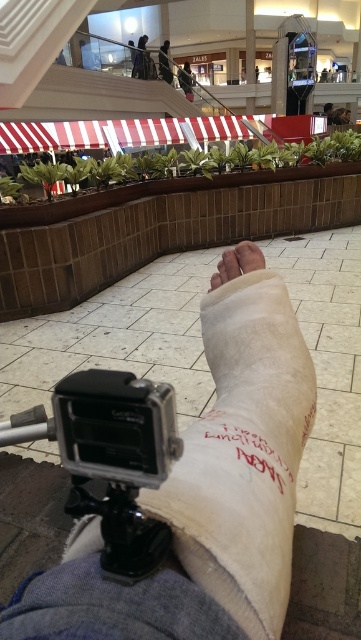
You are a physical therapist observing a patient who has a cast on their right leg. The patient is sitting in a mall with a GoPro camera on their chest. You notice a point marked at coordinates (244, 454). What object is located at that point?

The point at coordinates (244, 454) indicates the white cloth bandage at center.

You are a physical therapist observing a patient who has a white cloth bandage at center and a white bandage at center. Which bandage is located to the left?

The white cloth bandage at center is positioned on the left side of white bandage at center.